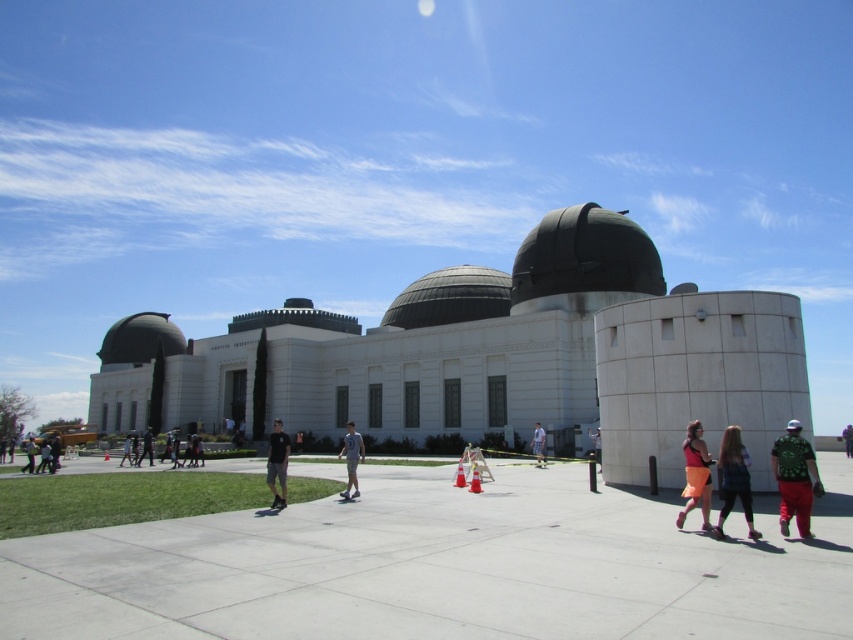
Is black textured dome at center taller than black fabric pants at center?

Yes, black textured dome at center is taller than black fabric pants at center.

Is point (410, 304) positioned in front of point (149, 435)?

No, (410, 304) is further to viewer.

Is point (422, 324) closer to viewer compared to point (148, 436)?

No.

Where is `black textured dome at center`? This screenshot has width=853, height=640. black textured dome at center is located at coordinates (450, 298).

Is matte black dome at left to the left of black fabric pants at center from the viewer's perspective?

Yes, matte black dome at left is to the left of black fabric pants at center.

Which of these two, matte black dome at left or black fabric pants at center, stands shorter?

Standing shorter between the two is black fabric pants at center.

I want to click on matte black dome at left, so click(140, 339).

Can you confirm if matte gray dome at center is taller than green fabric shirt at lower right?

Yes.

Does matte gray dome at center appear over green fabric shirt at lower right?

Yes.

Where is `matte gray dome at center`? The width and height of the screenshot is (853, 640). matte gray dome at center is located at coordinates (294, 317).